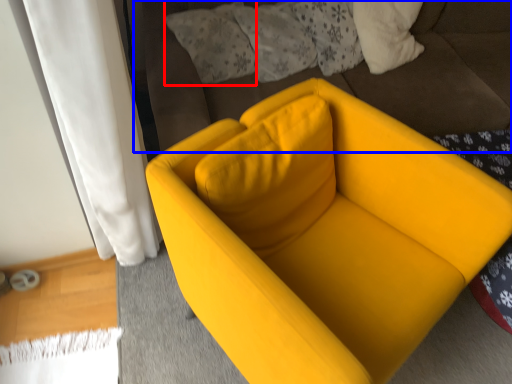
Question: Which of the following is the farthest to the observer, pillow (highlighted by a red box) or bedding (highlighted by a blue box)?

Choices:
 (A) pillow
 (B) bedding

Answer: (A)